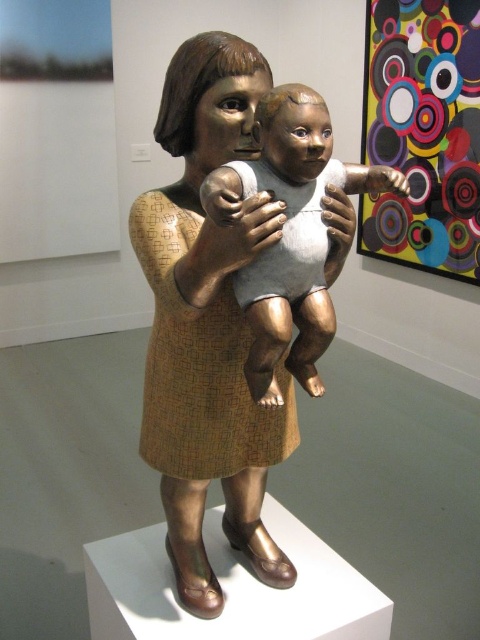
Does bronze statue at center have a smaller size compared to matte white baby at center?

Actually, bronze statue at center might be larger than matte white baby at center.

Can you confirm if bronze statue at center is shorter than matte white baby at center?

In fact, bronze statue at center may be taller than matte white baby at center.

Which is in front, point (216, 33) or point (294, 172)?

Positioned in front is point (294, 172).

What are the coordinates of `bronze statue at center` in the screenshot? It's located at (208, 323).

Which of these two, multicolored concentric circles on canvas at upper right or matte white baby at center, stands shorter?

With less height is matte white baby at center.

Is point (381, 4) more distant than point (297, 362)?

Yes, point (381, 4) is farther from viewer.

Locate an element on the screen. This screenshot has height=640, width=480. multicolored concentric circles on canvas at upper right is located at coordinates (423, 132).

Which of these two, bronze statue at center or multicolored concentric circles on canvas at upper right, stands shorter?

bronze statue at center is shorter.

Does bronze statue at center appear on the right side of multicolored concentric circles on canvas at upper right?

In fact, bronze statue at center is to the left of multicolored concentric circles on canvas at upper right.

Identify the location of bronze statue at center. (208, 323).

Image resolution: width=480 pixels, height=640 pixels. I want to click on bronze statue at center, so click(208, 323).